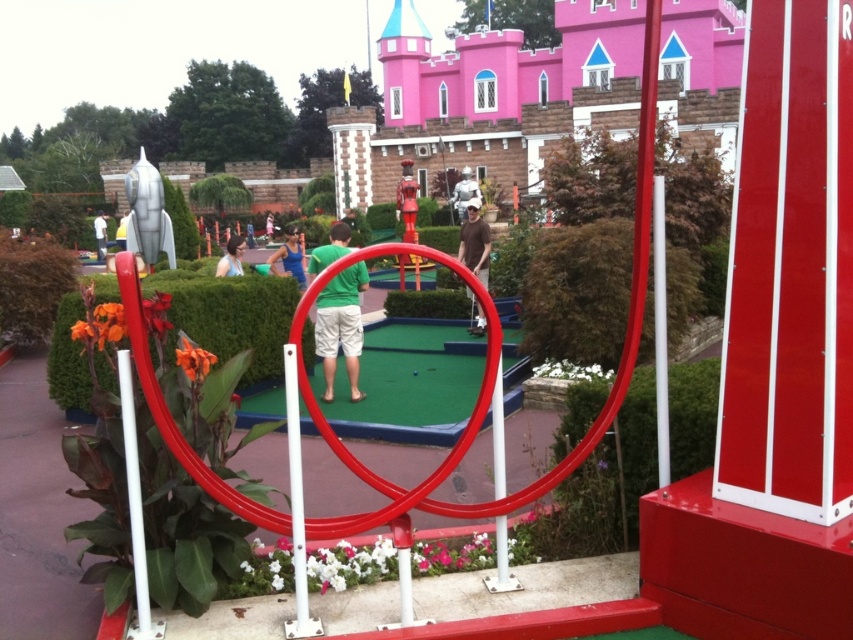
Does green matte shorts at center appear on the left side of white plastic pole at lower left?

No, green matte shorts at center is not to the left of white plastic pole at lower left.

Between point (326, 321) and point (134, 518), which one is positioned behind?

Positioned behind is point (326, 321).

At what (x,y) coordinates should I click in order to perform the action: click on green matte shorts at center. Please return your answer as a coordinate pair (x, y). This screenshot has height=640, width=853. Looking at the image, I should click on (340, 326).

Does white plastic pole at lower left have a larger size compared to matte blue shirt at center?

Incorrect, white plastic pole at lower left is not larger than matte blue shirt at center.

Can you confirm if white plastic pole at lower left is wider than matte blue shirt at center?

No, white plastic pole at lower left is not wider than matte blue shirt at center.

Find the location of `white plastic pole at lower left`. white plastic pole at lower left is located at coordinates (134, 506).

Can you confirm if brown matte shirt at center is positioned above matte blue shirt at center?

Correct, brown matte shirt at center is located above matte blue shirt at center.

Which is above, brown matte shirt at center or matte blue shirt at center?

brown matte shirt at center is above.

This screenshot has width=853, height=640. What are the coordinates of `brown matte shirt at center` in the screenshot? It's located at (474, 241).